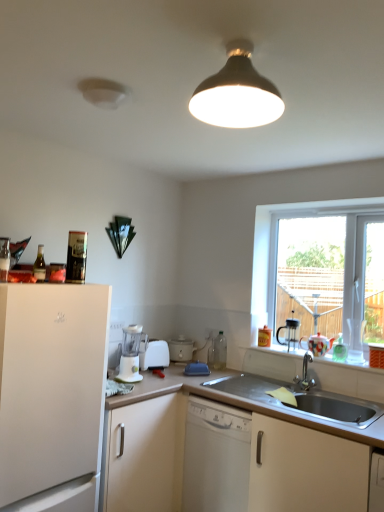
Question: Considering the relative positions of black plastic coffee machine at right, the 2th coffee machine positioned from the left, and white plastic coffee machine at lower center, the 2th coffee machine when ordered from back to front, in the image provided, is black plastic coffee machine at right, the 2th coffee machine positioned from the left, to the left or to the right of white plastic coffee machine at lower center, the 2th coffee machine when ordered from back to front,?

Choices:
 (A) right
 (B) left

Answer: (A)

Question: From a real-world perspective, is black plastic coffee machine at right, which appears as the first coffee machine when viewed from the back, physically located above or below white plastic coffee machine at lower center, the 2th coffee machine when ordered from back to front?

Choices:
 (A) below
 (B) above

Answer: (B)

Question: Which of these objects is positioned closest to the white matte dishwasher at center?

Choices:
 (A) stainless steel sink at lower right
 (B) black plastic coffee machine at right, the 2th coffee machine positioned from the left
 (C) white plastic coffee machine at lower center, which is counted as the second coffee machine, starting from the right
 (D) clear glass window at right
 (E) porcelain ceramic cups at lower right

Answer: (A)

Question: Which object is the closest to the black plastic coffee machine at right, the 2th coffee machine positioned from the left?

Choices:
 (A) white matte refrigerator at left, the first cabinetry when ordered from left to right
 (B) matte black lampshade at upper center
 (C) white matte dishwasher at center
 (D) stainless steel sink at lower right
 (E) white matte cabinet at lower center, which is counted as the second cabinetry, starting from the left

Answer: (D)